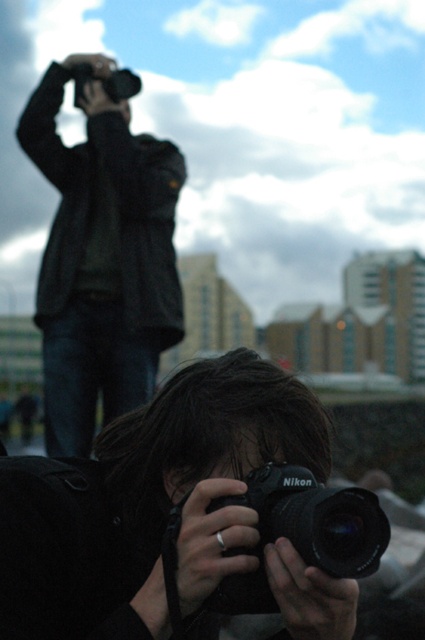
In the scene shown: Which is more to the right, black matte nikon camera at center or matte black camera at upper left?

From the viewer's perspective, black matte nikon camera at center appears more on the right side.

Is black matte nikon camera at center bigger than matte black camera at upper left?

No, black matte nikon camera at center is not bigger than matte black camera at upper left.

I want to click on black matte nikon camera at center, so 303,532.

Is point (48, 305) positioned after point (119, 83)?

No, (48, 305) is in front of (119, 83).

Is point (74, 394) positioned before point (121, 76)?

That is True.

Does point (85, 314) come in front of point (73, 76)?

Yes, point (85, 314) is in front of point (73, 76).

Identify the location of dark gray jacket at upper left. (102, 257).

Does dark gray jacket at upper left appear on the left side of black matte nikon camera at center?

Correct, you'll find dark gray jacket at upper left to the left of black matte nikon camera at center.

Who is more forward, (181, 307) or (367, 532)?

Point (367, 532)

Is point (133, 328) closer to camera compared to point (342, 516)?

No.

Find the location of a particular element. dark gray jacket at upper left is located at coordinates [102, 257].